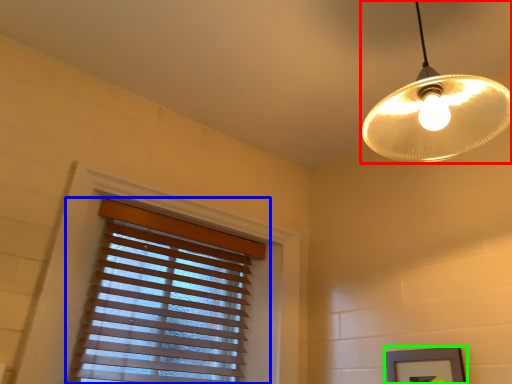
Question: Estimate the real-world distances between objects in this image. Which object is closer to lamp (highlighted by a red box), window blind (highlighted by a blue box) or picture frame (highlighted by a green box)?

Choices:
 (A) window blind
 (B) picture frame

Answer: (B)